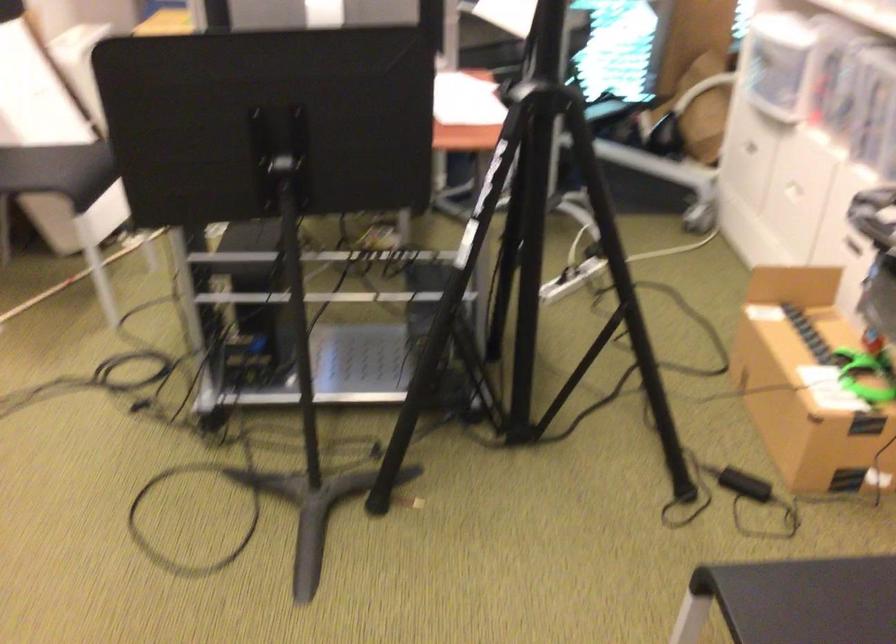
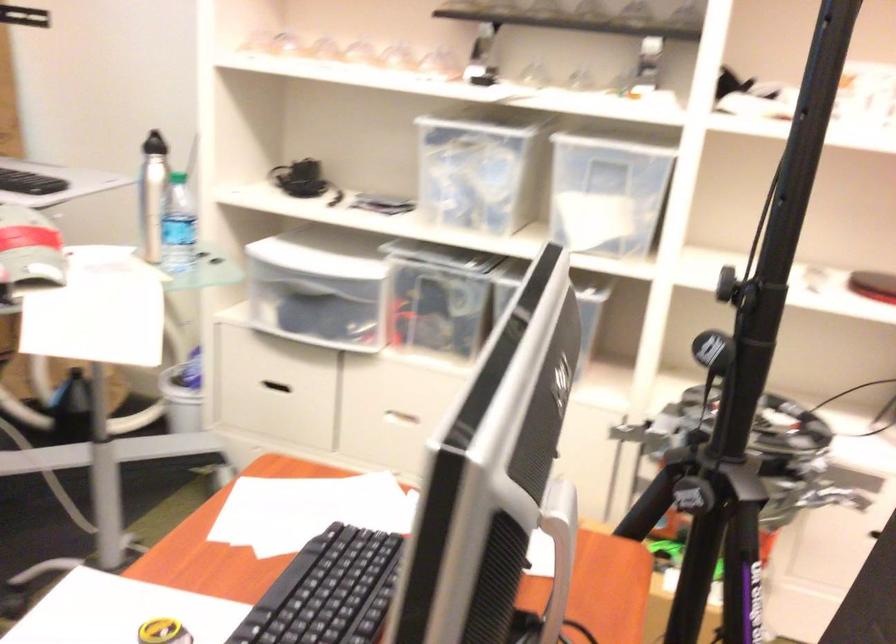
Where in the second image is the point corresponding to [737,134] from the first image?

(271, 389)